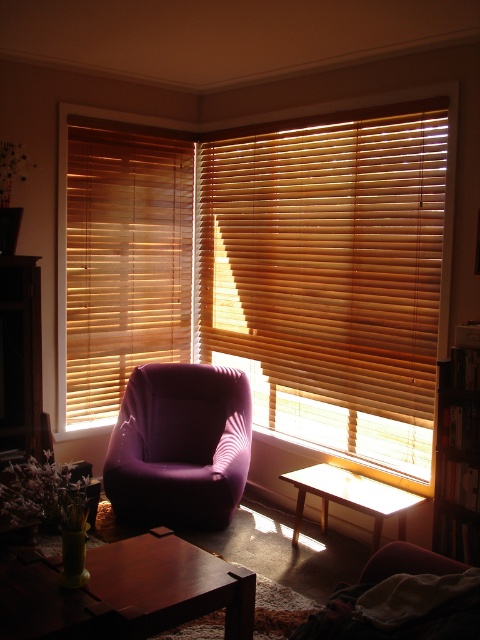
Does point (396, 461) come in front of point (187, 492)?

No.

Which is more to the left, wooden blinds at center or purple fabric armchair at center?

Positioned to the left is purple fabric armchair at center.

At what (x,y) coordinates should I click in order to perform the action: click on wooden blinds at center. Please return your answer as a coordinate pair (x, y). Looking at the image, I should click on (330, 275).

Where is `wooden blinds at center`? This screenshot has height=640, width=480. wooden blinds at center is located at coordinates (330, 275).

Who is taller, purple fabric armchair at center or purple fabric couch at lower right?

Standing taller between the two is purple fabric armchair at center.

Can you confirm if purple fabric armchair at center is wider than purple fabric couch at lower right?

Yes.

The height and width of the screenshot is (640, 480). What do you see at coordinates (180, 445) in the screenshot? I see `purple fabric armchair at center` at bounding box center [180, 445].

Identify the location of purple fabric armchair at center. The height and width of the screenshot is (640, 480). (180, 445).

Between wooden blinds at center and purple fabric couch at lower right, which one appears on the right side from the viewer's perspective?

From the viewer's perspective, purple fabric couch at lower right appears more on the right side.

Which of these two, wooden blinds at center or purple fabric couch at lower right, stands taller?

Standing taller between the two is wooden blinds at center.

Is point (360, 193) less distant than point (433, 557)?

No, it is behind (433, 557).

You are a GUI agent. You are given a task and a screenshot of the screen. Output one action in this format:
    pyautogui.click(x=<x>, y=<y>)
    Task: Click on the wooden blinds at center
    Image resolution: width=480 pixels, height=640 pixels.
    Given the screenshot: What is the action you would take?
    pyautogui.click(x=330, y=275)